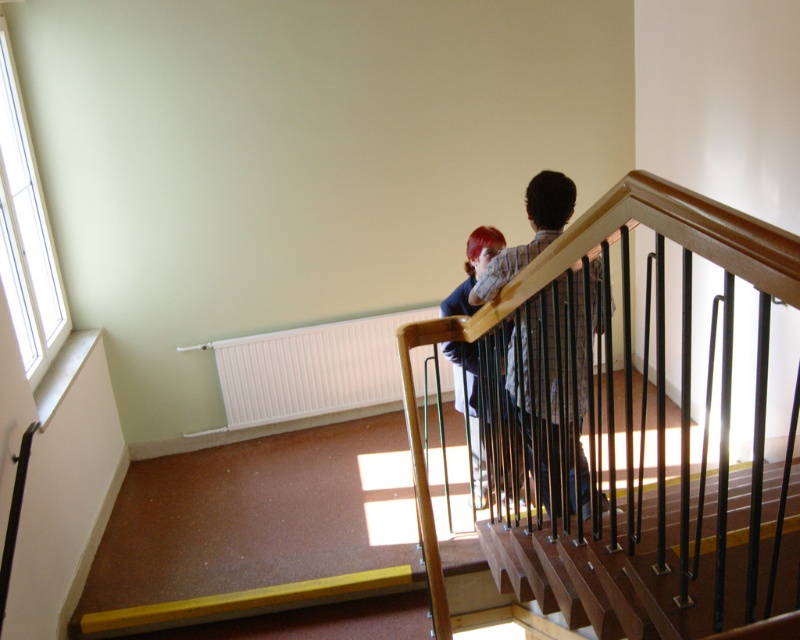
Question: Among these objects, which one is farthest from the camera?

Choices:
 (A) plaid shirt at center
 (B) plaid shirt at upper center

Answer: (A)

Question: Is plaid shirt at upper center below plaid shirt at center?

Choices:
 (A) no
 (B) yes

Answer: (B)

Question: Can you confirm if wooden at upper center is positioned to the right of plaid shirt at center?

Choices:
 (A) no
 (B) yes

Answer: (B)

Question: Is the position of wooden at upper center more distant than that of wooden handrail at upper center?

Choices:
 (A) yes
 (B) no

Answer: (A)

Question: Among these points, which one is nearest to the camera?

Choices:
 (A) (496, 465)
 (B) (598, 209)
 (C) (554, 577)

Answer: (B)

Question: Which of the following is the closest to the observer?

Choices:
 (A) plaid shirt at center
 (B) wooden at upper center
 (C) wooden handrail at upper center

Answer: (C)